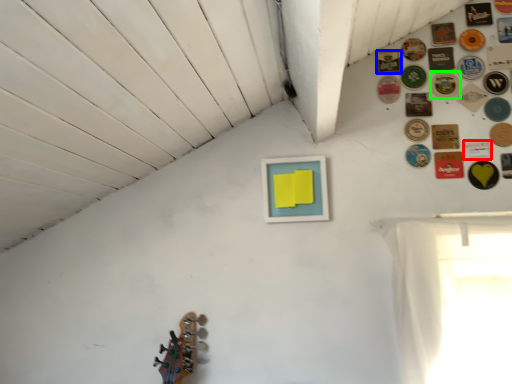
Question: Based on their relative distances, which object is farther from button (highlighted by a red box)? Choose from button (highlighted by a blue box) and button (highlighted by a green box).

Choices:
 (A) button
 (B) button

Answer: (A)